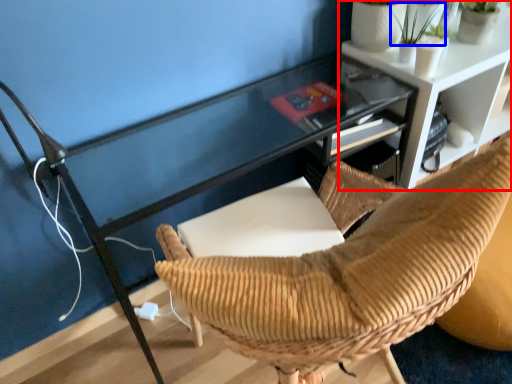
Question: Among these objects, which one is farthest to the camera, shelf (highlighted by a red box) or plant (highlighted by a blue box)?

Choices:
 (A) shelf
 (B) plant

Answer: (A)